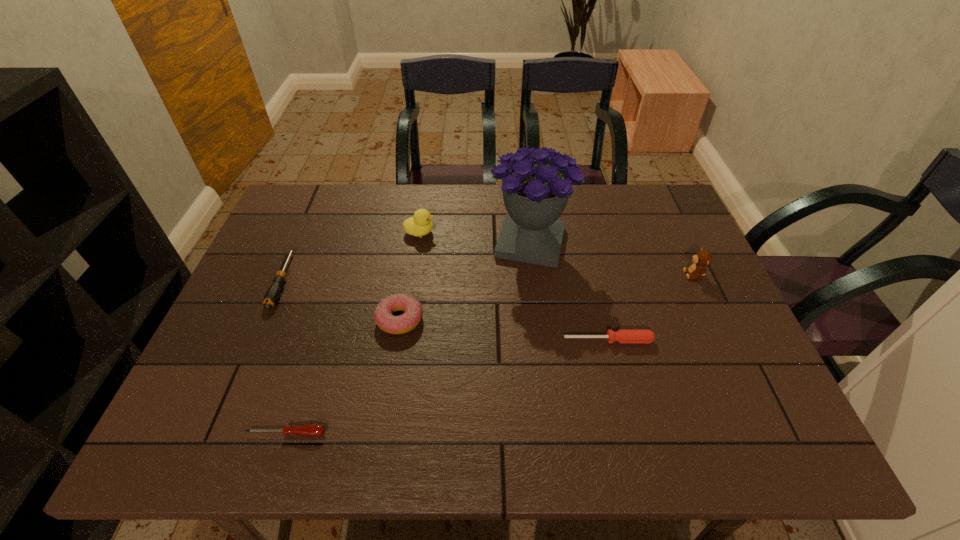
You are a GUI agent. You are given a task and a screenshot of the screen. Output one action in this format:
    pyautogui.click(x=<x>, y=<y>)
    Task: Click on the tallest object
    The image size is (960, 540).
    Given the screenshot: What is the action you would take?
    pyautogui.click(x=536, y=183)

Where is `teddy bear`? teddy bear is located at coordinates (701, 259).

You are a GUI agent. You are given a task and a screenshot of the screen. Output one action in this format:
    pyautogui.click(x=<x>, y=<y>)
    Task: Click on the duckling
    This screenshot has height=540, width=960.
    Given the screenshot: What is the action you would take?
    tap(420, 224)

Find the location of `the fourth shortest object`. the fourth shortest object is located at coordinates (413, 311).

Where is `the tallest screwdriver`? This screenshot has width=960, height=540. the tallest screwdriver is located at coordinates (272, 294).

The height and width of the screenshot is (540, 960). Find the location of `the farthest screwdriver`. the farthest screwdriver is located at coordinates (272, 294).

Locate an element on the screen. the second shortest object is located at coordinates (623, 335).

I want to click on the second shortest screwdriver, so click(623, 335).

Where is `the shortest object`? the shortest object is located at coordinates (311, 430).

Find the location of a particular element. the nearest screwdriver is located at coordinates (311, 430).